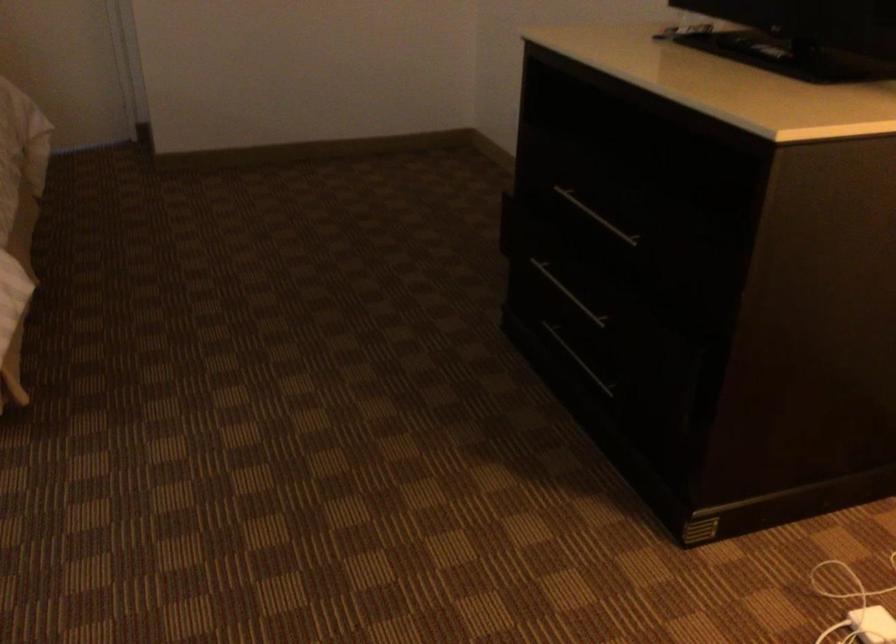
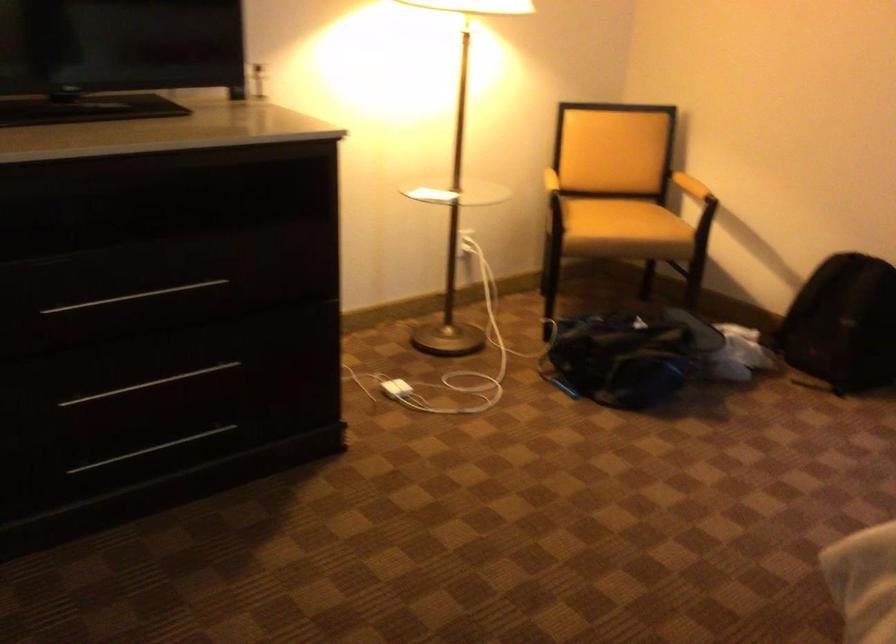
Find the pixel in the second image that matches point 578,297 in the first image.

(149, 384)